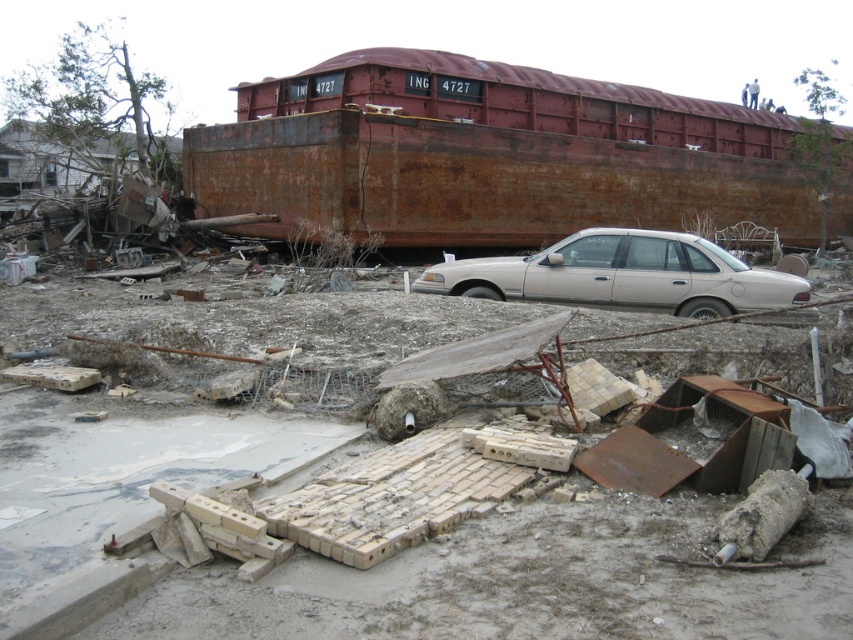
You are a construction worker assessing the site. You need to determine which object is narrower between the rusty metal debris at center and the rusty metal train car at upper center. Which one should you report?

The rusty metal debris at center is thinner than the rusty metal train car at upper center, so you should report that the rusty metal debris at center is narrower.

You are a rescue worker trying to reach the white matte sedan at center. There is a pile of rusty metal debris at center in your path. Can you safely walk around the debris to reach the car?

The rusty metal debris at center is positioned under the white matte sedan at center, meaning the debris is directly beneath the car. This suggests the car is resting on top of the debris, so there is no clear path around it. You cannot safely walk around the debris to reach the white matte sedan at center.